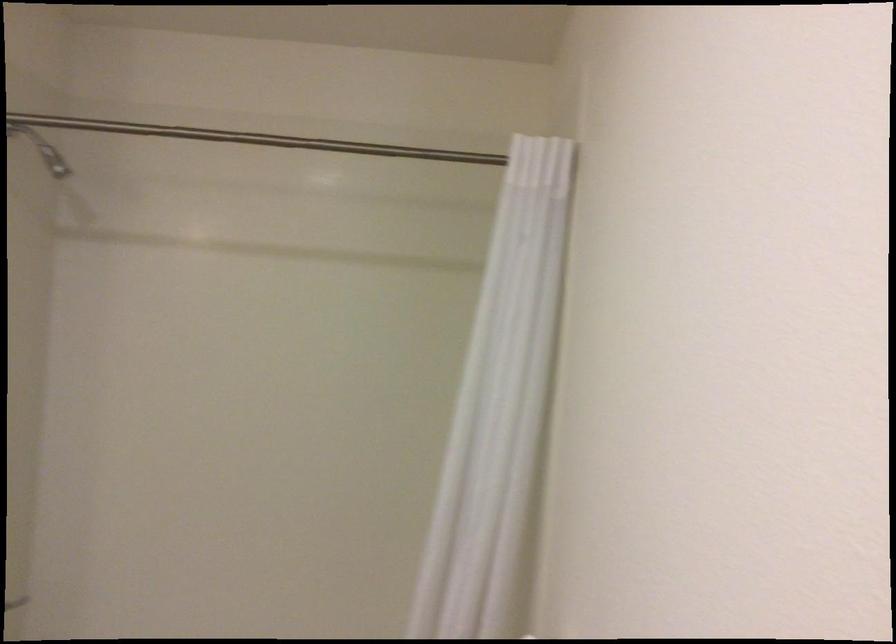
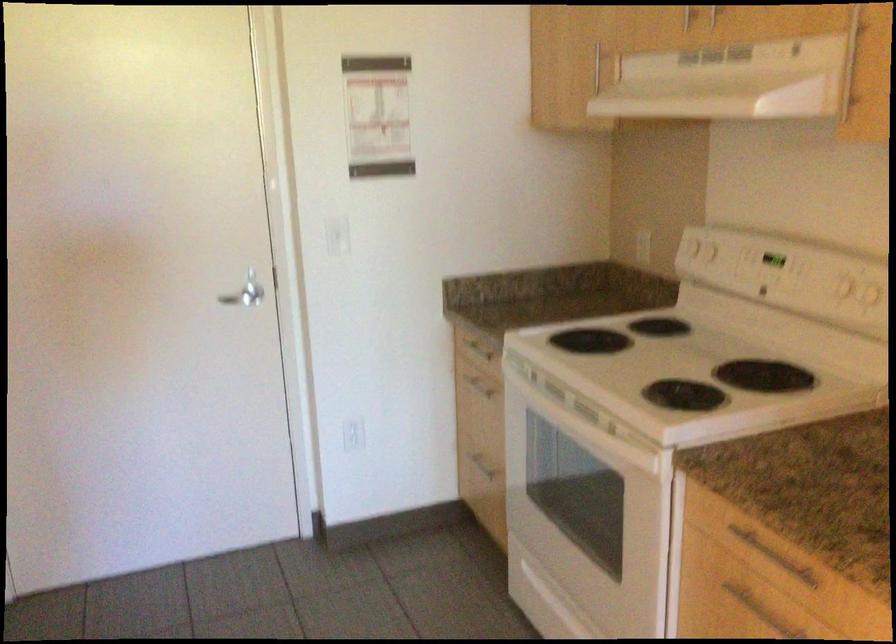
Question: The images are taken continuously from a first-person perspective. In which direction are you moving?

Choices:
 (A) Left
 (B) Right
 (C) Forward
 (D) Backward

Answer: (B)